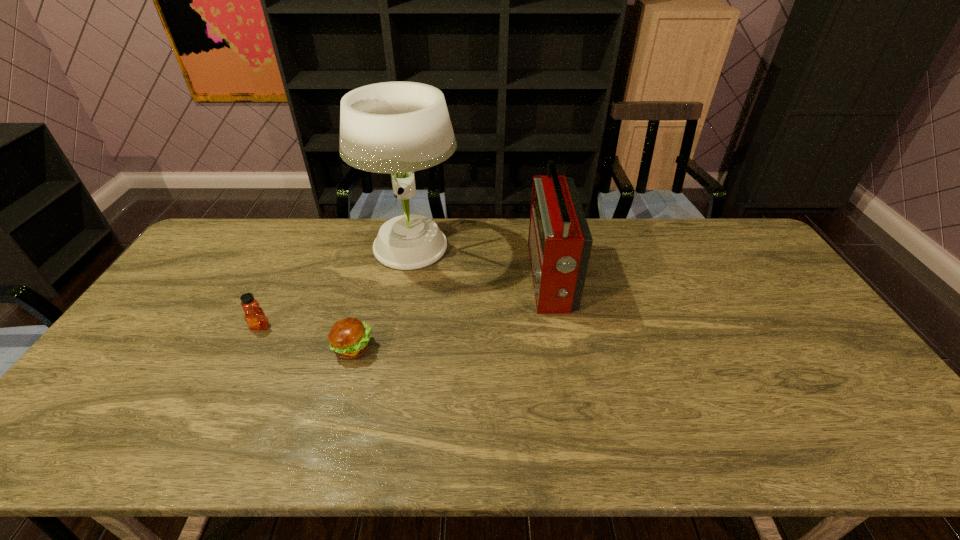
Identify the location of vacant space that satisfies the following two spatial constraints: 1. on the front-facing side of the second tallest object; 2. on the front label of the leftmost object. (559, 327).

The image size is (960, 540). Identify the location of vacant space that satisfies the following two spatial constraints: 1. on the front-facing side of the lamp; 2. on the front label of the honey. [396, 327].

The width and height of the screenshot is (960, 540). In order to click on blank area in the image that satisfies the following two spatial constraints: 1. on the front-facing side of the rightmost object; 2. on the front label of the leftmost object in this screenshot , I will do `click(559, 327)`.

The image size is (960, 540). In order to click on free space that satisfies the following two spatial constraints: 1. on the front-facing side of the radio receiver; 2. on the front label of the third tallest object in this screenshot , I will do `click(559, 327)`.

Find the location of a particular element. blank area in the image that satisfies the following two spatial constraints: 1. on the front-facing side of the second tallest object; 2. on the front label of the honey is located at coordinates (559, 327).